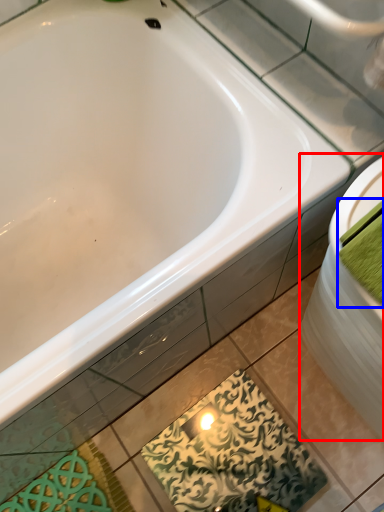
Question: Which point is further to the camera, sink (highlighted by a red box) or bath towel (highlighted by a blue box)?

Choices:
 (A) sink
 (B) bath towel

Answer: (A)